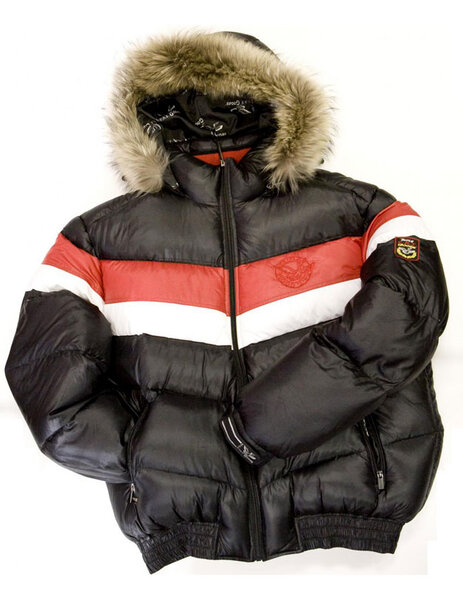
The height and width of the screenshot is (600, 463). Find the location of `hood`. hood is located at coordinates (213, 128).